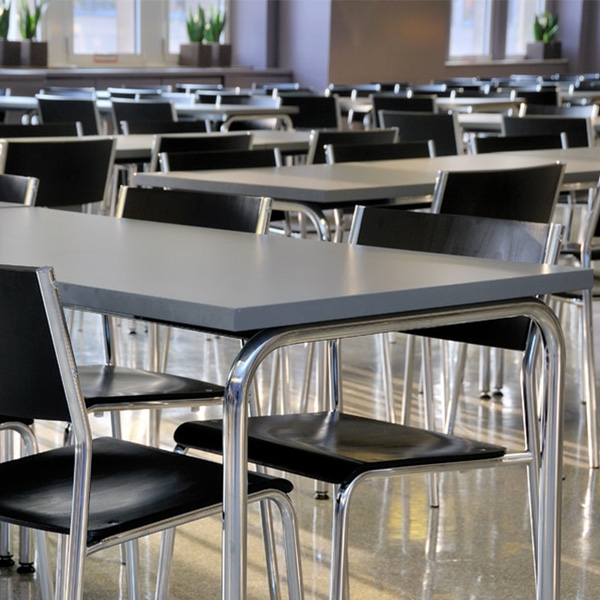
Find the location of `tables`. tables is located at coordinates (102, 103), (182, 95), (464, 103), (581, 93), (487, 118), (463, 163), (276, 138), (257, 264).